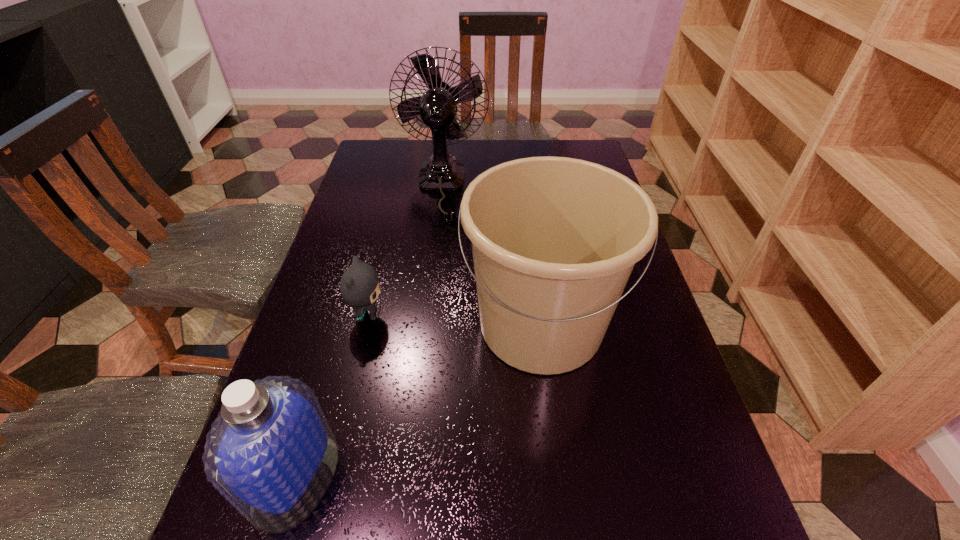
You are a GUI agent. You are given a task and a screenshot of the screen. Output one action in this format:
    pyautogui.click(x=<x>, y=<y>)
    Task: Click on the vacant region that satisfies the following two spatial constraints: 1. in front of the fan, indicating the direction of air flow; 2. on the front-facing side of the kitten
    
    Given the screenshot: What is the action you would take?
    pyautogui.click(x=426, y=315)

In order to click on vacant region that satisfies the following two spatial constraints: 1. in front of the bucket, indicating the direction of air flow; 2. on the right side of the fan in this screenshot , I will do `click(425, 325)`.

I want to click on free space that satisfies the following two spatial constraints: 1. on the front-facing side of the shortest object; 2. on the back side of the bucket, so click(x=366, y=325).

Find the location of `free space in the image that satisfies the following two spatial constraints: 1. in front of the fan, indicating the direction of air flow; 2. on the left side of the bucket`. free space in the image that satisfies the following two spatial constraints: 1. in front of the fan, indicating the direction of air flow; 2. on the left side of the bucket is located at coordinates (425, 325).

Identify the location of free point that satisfies the following two spatial constraints: 1. in front of the fan, indicating the direction of air flow; 2. on the front-facing side of the shortest object. The height and width of the screenshot is (540, 960). (426, 315).

Find the location of a particular element. The height and width of the screenshot is (540, 960). vacant space that satisfies the following two spatial constraints: 1. in front of the farthest object, indicating the direction of air flow; 2. on the front-facing side of the shortest object is located at coordinates (426, 315).

Find the location of a particular element. The height and width of the screenshot is (540, 960). vacant space that satisfies the following two spatial constraints: 1. on the front-facing side of the kitten; 2. on the back side of the bucket is located at coordinates (366, 325).

Identify the location of free space that satisfies the following two spatial constraints: 1. in front of the bucket, indicating the direction of air flow; 2. on the left side of the farthest object. This screenshot has width=960, height=540. (425, 325).